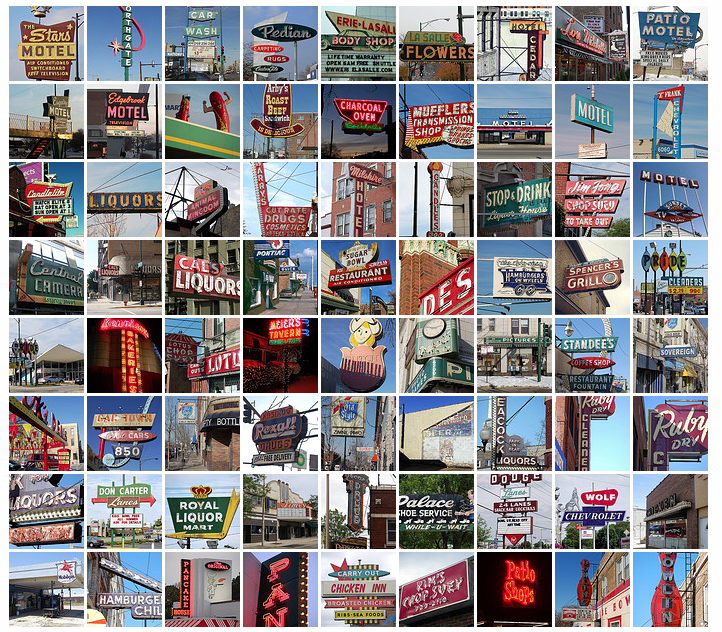
Identify the location of ladder. This screenshot has height=632, width=722. (686, 569).